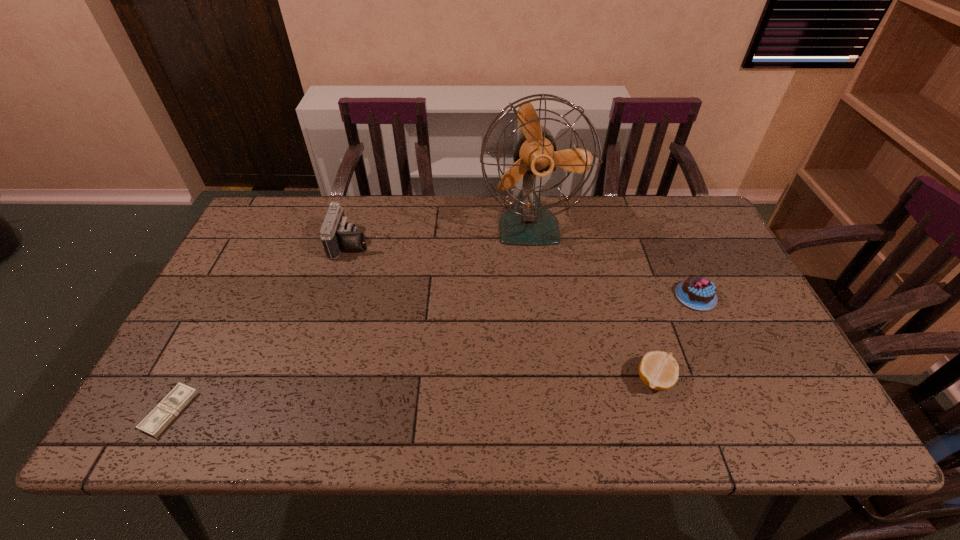
Image resolution: width=960 pixels, height=540 pixels. Find the location of `unoccupied area between the money and the third farthest object`. unoccupied area between the money and the third farthest object is located at coordinates coord(433,354).

This screenshot has width=960, height=540. Find the location of `free point between the leftmost object and the camera`. free point between the leftmost object and the camera is located at coordinates (260, 327).

The image size is (960, 540). I want to click on vacant area between the tallest object and the lemon, so click(x=592, y=303).

The height and width of the screenshot is (540, 960). In order to click on free space between the shortest object and the second tallest object in this screenshot , I will do `click(260, 327)`.

You are a GUI agent. You are given a task and a screenshot of the screen. Output one action in this format:
    pyautogui.click(x=<x>, y=<y>)
    Task: Click on the object that stands as the third closest to the chocolate cake
    The image size is (960, 540).
    Given the screenshot: What is the action you would take?
    pyautogui.click(x=337, y=234)

Where is `object that is the third nearest to the rightmost object`? object that is the third nearest to the rightmost object is located at coordinates (337, 234).

This screenshot has height=540, width=960. In order to click on blank space that satisfies the following two spatial constraints: 1. on the back side of the fourth object from left to right; 2. at the front of the camera with an open lens cover in this screenshot , I will do `click(612, 242)`.

Identify the location of vacant area in the image that satisfies the following two spatial constraints: 1. at the front of the fourth shortest object with an open lens cover; 2. on the back side of the third nearest object. Image resolution: width=960 pixels, height=540 pixels. (334, 296).

The height and width of the screenshot is (540, 960). What are the coordinates of `free space that satisfies the following two spatial constraints: 1. on the front-facing side of the third object from right to left for air flow; 2. on the right side of the rightmost object` in the screenshot? It's located at (539, 296).

Locate an element on the screen. blank space that satisfies the following two spatial constraints: 1. on the front-facing side of the third object from left to right for air flow; 2. at the front of the camera with an open lens cover is located at coordinates (532, 242).